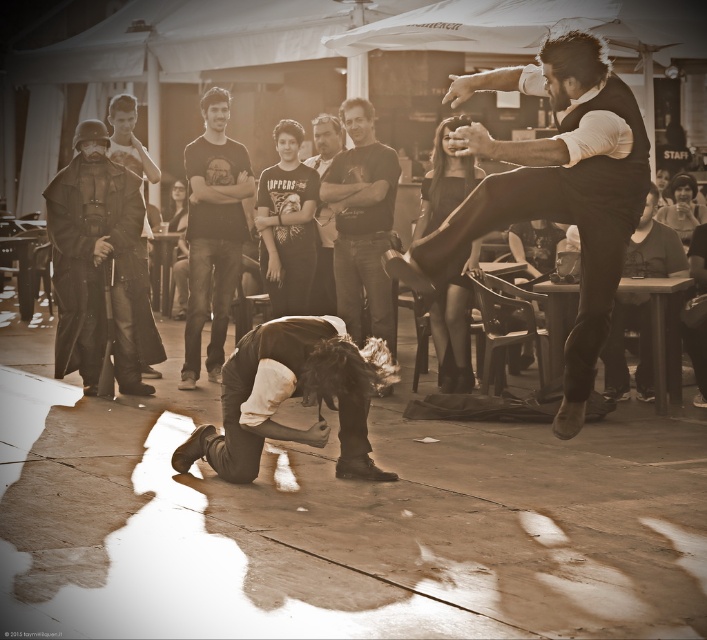
Question: Which is nearer to the dark matte costume at left?

Choices:
 (A) dark gray shirt at center
 (B) smooth skin face at upper right

Answer: (A)

Question: Among these points, which one is nearest to the camera?

Choices:
 (A) (239, 369)
 (B) (296, 241)

Answer: (A)

Question: Which of the following is the farthest from the observer?

Choices:
 (A) black cotton t-shirt at center
 (B) smooth skin face at upper right
 (C) dark brown leather skateboard at lower center
 (D) smooth black dress at center

Answer: (B)

Question: Is dark matte costume at left below dark brown leather skateboard at lower center?

Choices:
 (A) no
 (B) yes

Answer: (A)

Question: Can you confirm if matte black helmet at left is wider than dark hair at center?

Choices:
 (A) no
 (B) yes

Answer: (A)

Question: Considering the relative positions of dark cotton t-shirt at center and smooth black dress at center in the image provided, where is dark cotton t-shirt at center located with respect to smooth black dress at center?

Choices:
 (A) above
 (B) below

Answer: (B)